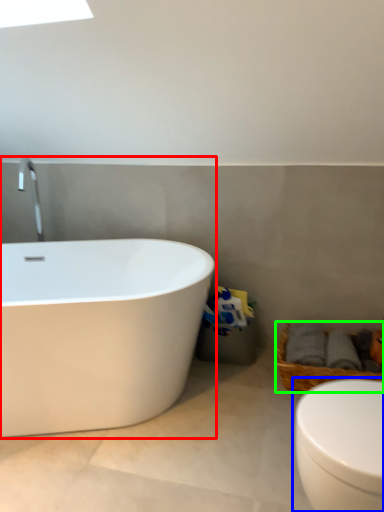
Question: Estimate the real-world distances between objects in this image. Which object is farther from bathtub (highlighted by a red box), toilet (highlighted by a blue box) or basket (highlighted by a green box)?

Choices:
 (A) toilet
 (B) basket

Answer: (A)